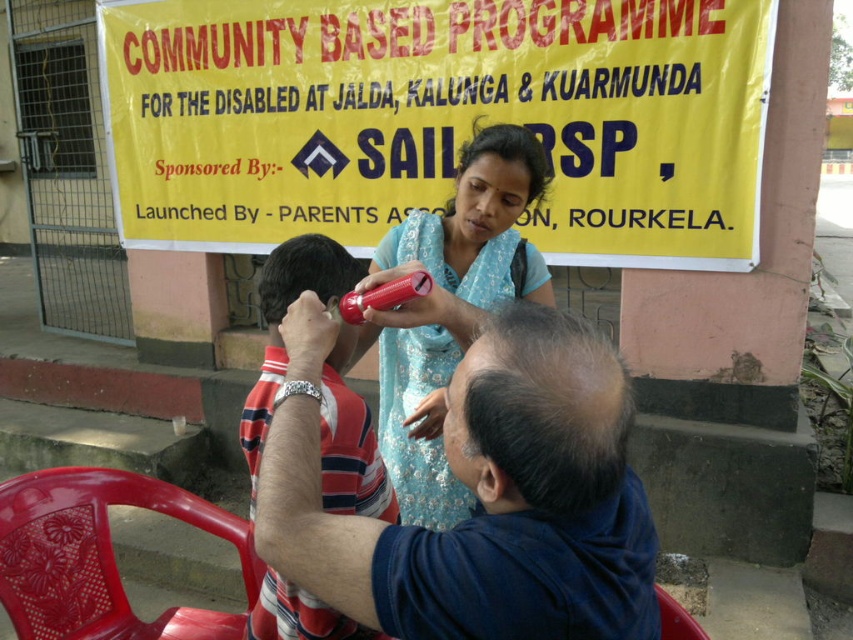
Which of these two, blue embroidered saree at center or plastic chair at lower right, stands taller?

blue embroidered saree at center is taller.

Find the location of a particular element. blue embroidered saree at center is located at coordinates (451, 308).

Locate an element on the screen. This screenshot has width=853, height=640. blue embroidered saree at center is located at coordinates (451, 308).

Can you confirm if red plastic chair at lower left is wider than striped cotton shirt at center?

Correct, the width of red plastic chair at lower left exceeds that of striped cotton shirt at center.

Which is behind, point (254, 561) or point (352, 499)?

Positioned behind is point (254, 561).

Find the location of a particular element. Image resolution: width=853 pixels, height=640 pixels. red plastic chair at lower left is located at coordinates (100, 556).

You are a GUI agent. You are given a task and a screenshot of the screen. Output one action in this format:
    pyautogui.click(x=<x>, y=<y>)
    Task: Click on the red plastic chair at lower left
    This screenshot has width=853, height=640.
    Given the screenshot: What is the action you would take?
    pyautogui.click(x=100, y=556)

Is yellow paper sign at upper center bigger than dark brown hair at center?

Indeed, yellow paper sign at upper center has a larger size compared to dark brown hair at center.

Measure the distance between yellow paper sign at upper center and dark brown hair at center.

The distance of yellow paper sign at upper center from dark brown hair at center is 2.45 meters.

Image resolution: width=853 pixels, height=640 pixels. What do you see at coordinates (438, 120) in the screenshot? I see `yellow paper sign at upper center` at bounding box center [438, 120].

Where is `yellow paper sign at upper center`? The image size is (853, 640). yellow paper sign at upper center is located at coordinates (438, 120).